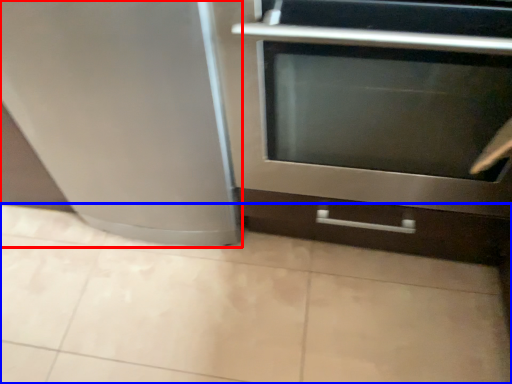
Question: Which of the following is the closest to the observer, appliance (highlighted by a red box) or ceramic tile (highlighted by a blue box)?

Choices:
 (A) appliance
 (B) ceramic tile

Answer: (A)